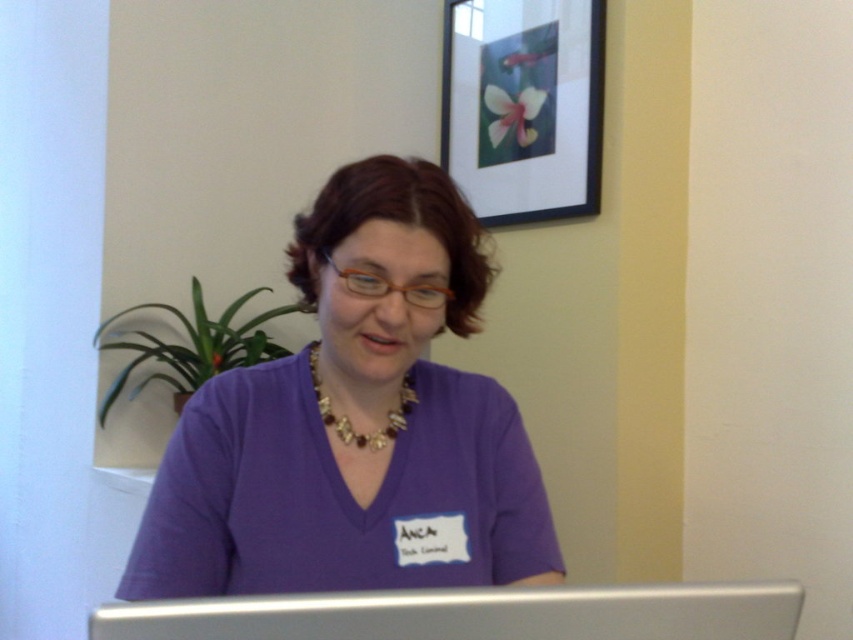
Question: Is purple fabric shirt at center positioned in front of silver metallic laptop at center?

Choices:
 (A) yes
 (B) no

Answer: (B)

Question: Which point is farther to the camera?

Choices:
 (A) (318, 259)
 (B) (598, 204)
 (C) (398, 404)

Answer: (B)

Question: Can you confirm if purple fabric shirt at center is thinner than silver metallic laptop at center?

Choices:
 (A) yes
 (B) no

Answer: (A)

Question: Among these objects, which one is farthest from the camera?

Choices:
 (A) purple fabric shirt at center
 (B) black matte picture frame at upper center

Answer: (B)

Question: Does purple fabric shirt at center have a smaller size compared to black matte picture frame at upper center?

Choices:
 (A) no
 (B) yes

Answer: (B)

Question: Which point is closer to the camera?

Choices:
 (A) silver metallic laptop at center
 (B) gold/beaded necklace at center
 (C) black matte picture frame at upper center
 (D) purple fabric shirt at center

Answer: (A)